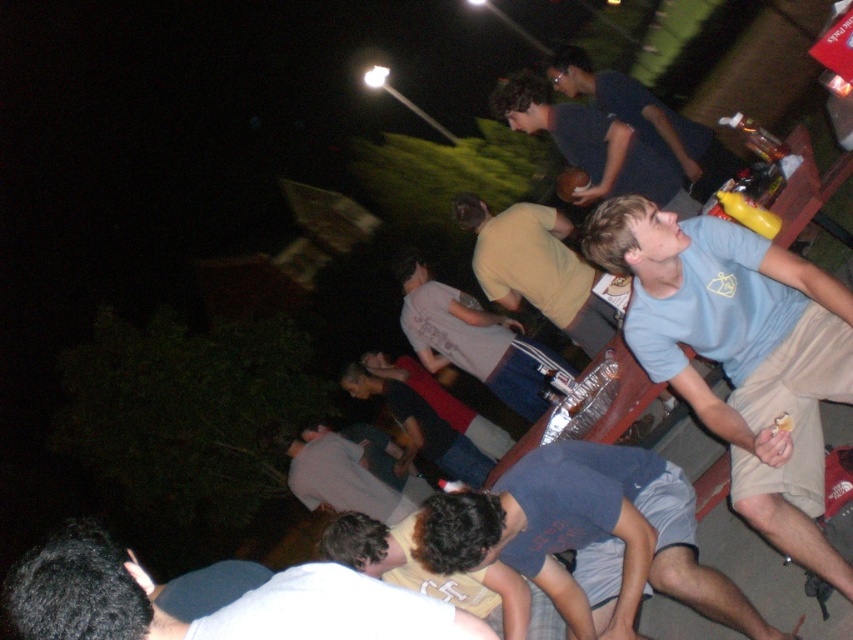
You are standing at the entrance of the gathering and want to locate two people. The first person has dark brown hair at lower left and the second has dark blue jeans at center. Which person is positioned more to the right side of the scene?

The dark brown hair at lower left is to the right of dark blue jeans at center, so the person with dark brown hair at lower left is positioned more to the right side of the scene.